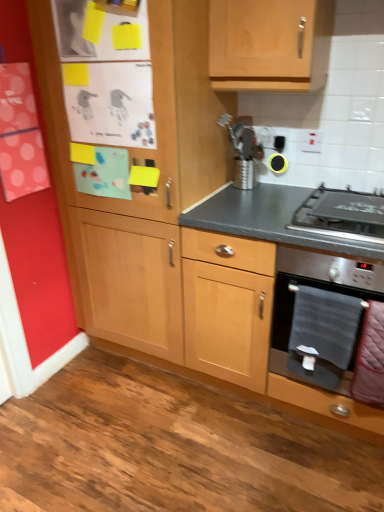
Question: Are velvet pink blanket at lower right, the 2th blanket positioned from the left, and black rubber earbud at upper center located far from each other?

Choices:
 (A) yes
 (B) no

Answer: (B)

Question: Is velvet pink blanket at lower right, the 2th blanket positioned from the left, at the left side of black rubber earbud at upper center?

Choices:
 (A) no
 (B) yes

Answer: (A)

Question: From the image's perspective, does velvet pink blanket at lower right, the 2th blanket positioned from the left, appear lower than black rubber earbud at upper center?

Choices:
 (A) yes
 (B) no

Answer: (A)

Question: Can you confirm if velvet pink blanket at lower right, the 2th blanket positioned from the left, is shorter than black rubber earbud at upper center?

Choices:
 (A) no
 (B) yes

Answer: (A)

Question: Can you confirm if velvet pink blanket at lower right, which is counted as the first blanket, starting from the right, is bigger than black rubber earbud at upper center?

Choices:
 (A) yes
 (B) no

Answer: (A)

Question: Is velvet pink blanket at lower right, the 2th blanket positioned from the left, behind black rubber earbud at upper center?

Choices:
 (A) yes
 (B) no

Answer: (B)

Question: Is velvet pink blanket at lower right, which is counted as the first blanket, starting from the right, facing towards stainless steel oven at lower right?

Choices:
 (A) no
 (B) yes

Answer: (A)

Question: Is velvet pink blanket at lower right, the 2th blanket positioned from the left, taller than stainless steel oven at lower right?

Choices:
 (A) no
 (B) yes

Answer: (A)

Question: Is velvet pink blanket at lower right, the 2th blanket positioned from the left, completely or partially outside of stainless steel oven at lower right?

Choices:
 (A) yes
 (B) no

Answer: (A)

Question: Considering the relative sizes of velvet pink blanket at lower right, the 2th blanket positioned from the left, and stainless steel oven at lower right in the image provided, is velvet pink blanket at lower right, the 2th blanket positioned from the left, bigger than stainless steel oven at lower right?

Choices:
 (A) no
 (B) yes

Answer: (A)

Question: Does velvet pink blanket at lower right, the 2th blanket positioned from the left, have a lesser height compared to stainless steel oven at lower right?

Choices:
 (A) no
 (B) yes

Answer: (B)

Question: Is velvet pink blanket at lower right, the 2th blanket positioned from the left, smaller than stainless steel oven at lower right?

Choices:
 (A) no
 (B) yes

Answer: (B)

Question: Can you confirm if stainless steel gas stove at lower right is positioned to the left of gray fabric towel at lower right, which appears as the second blanket when viewed from the right?

Choices:
 (A) yes
 (B) no

Answer: (B)